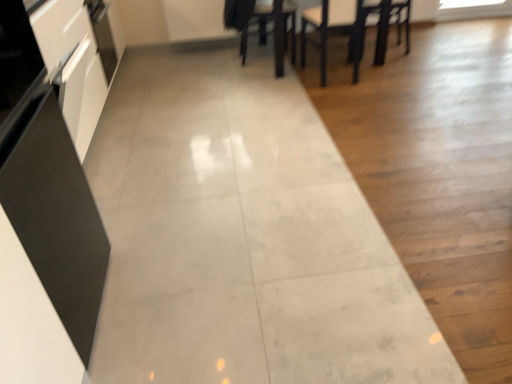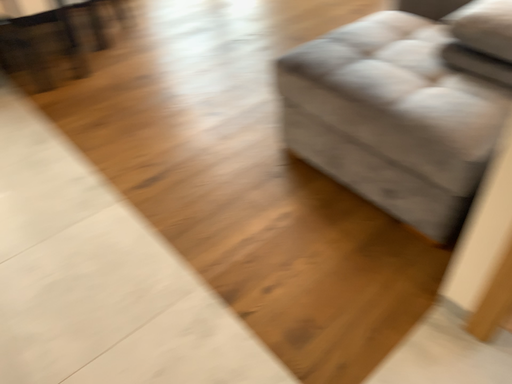
Question: Which way did the camera rotate in the video?

Choices:
 (A) rotated right
 (B) rotated left

Answer: (A)